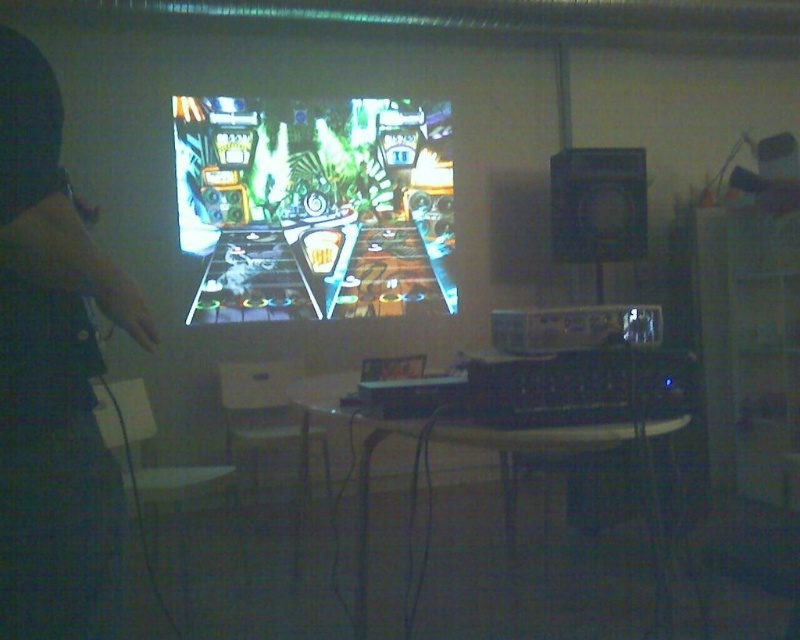
Which is more to the right, dark fabric hand at left or shiny plastic pinball machine at center?

From the viewer's perspective, dark fabric hand at left appears more on the right side.

Image resolution: width=800 pixels, height=640 pixels. Find the location of `dark fabric hand at left`. dark fabric hand at left is located at coordinates (52, 374).